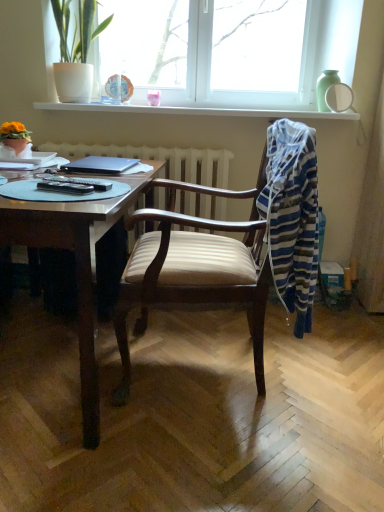
At what (x,y) coordinates should I click in order to perform the action: click on vacant area that is in front of matte orange flower pot at left, which is the second houseplant from back to front. Please return your answer as a coordinate pair (x, y). This screenshot has width=384, height=512. Looking at the image, I should click on (14, 160).